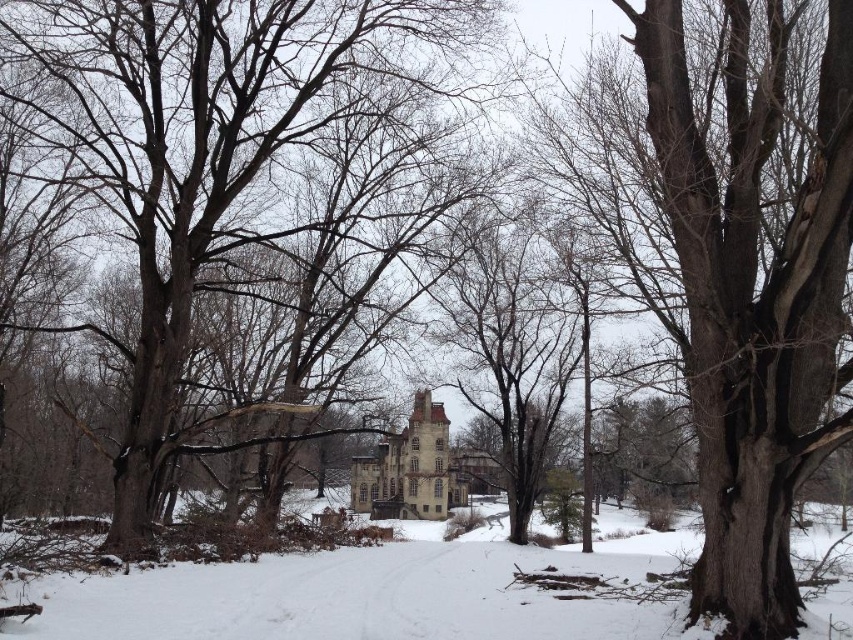
Question: Which point appears farthest from the camera in this image?

Choices:
 (A) (206, 292)
 (B) (434, 550)

Answer: (A)

Question: Which object is farther from the camera taking this photo?

Choices:
 (A) smooth brown tree trunk at center
 (B) white powdery snow at center

Answer: (A)

Question: Is smooth brown tree trunk at center positioned before white powdery snow at center?

Choices:
 (A) no
 (B) yes

Answer: (A)

Question: Can you confirm if smooth brown tree trunk at center is positioned to the left of white powdery snow at center?

Choices:
 (A) yes
 (B) no

Answer: (A)

Question: Which object is closer to the camera taking this photo?

Choices:
 (A) smooth brown tree trunk at center
 (B) white powdery snow at center

Answer: (B)

Question: Does smooth brown tree trunk at center have a greater width compared to white powdery snow at center?

Choices:
 (A) no
 (B) yes

Answer: (A)